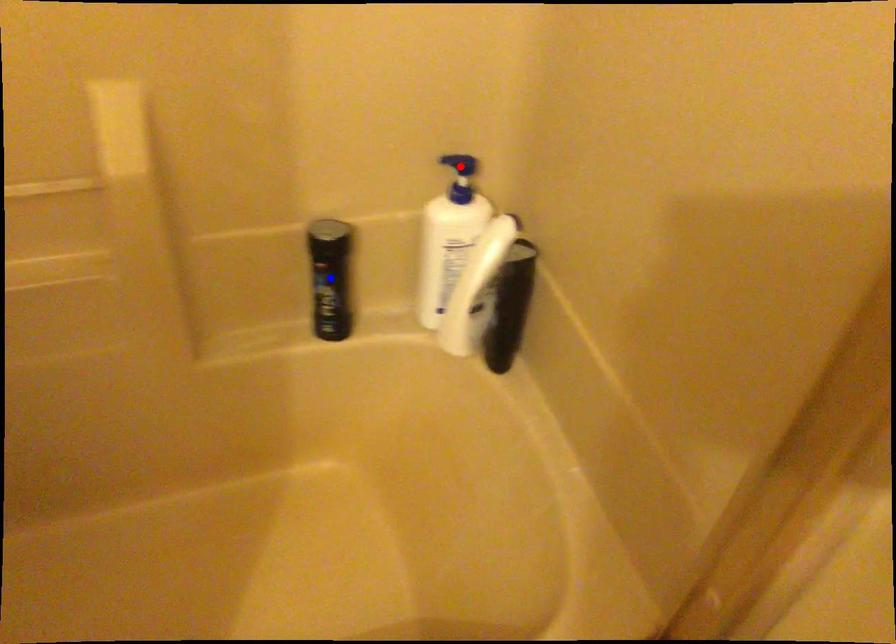
Question: In the image, two points are highlighted. Which point is nearer to the camera? Reply with the corresponding letter.

Choices:
 (A) blue point
 (B) red point

Answer: (A)